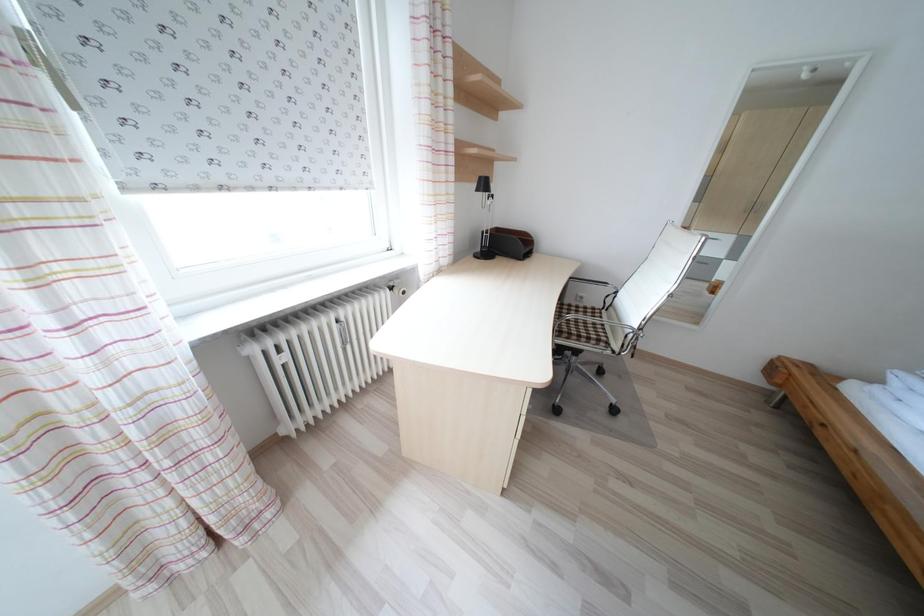
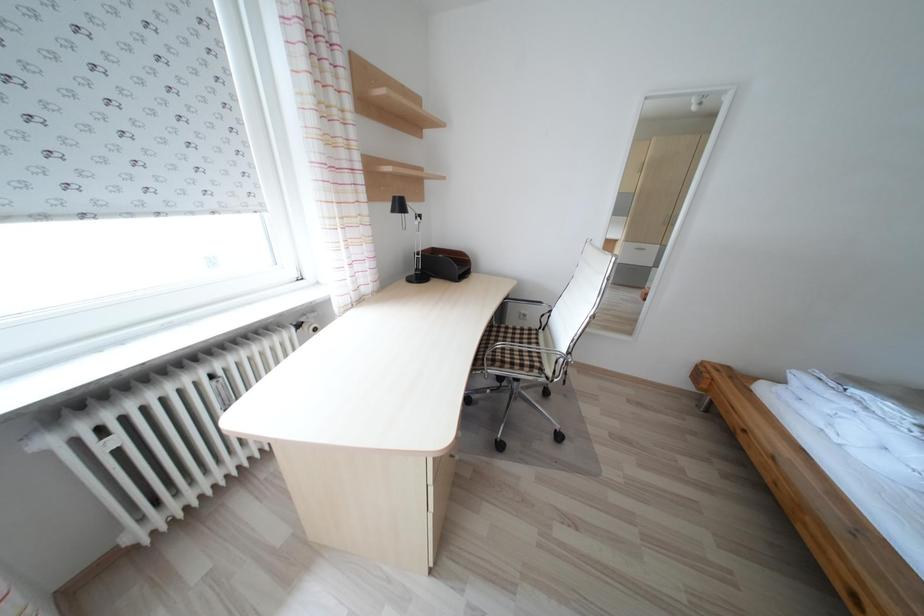
Question: The camera is either moving clockwise (left) or counter-clockwise (right) around the object. The first image is from the beginning of the video and the second image is from the end. Is the camera moving left or right when shooting the video?

Choices:
 (A) Left
 (B) Right

Answer: (A)